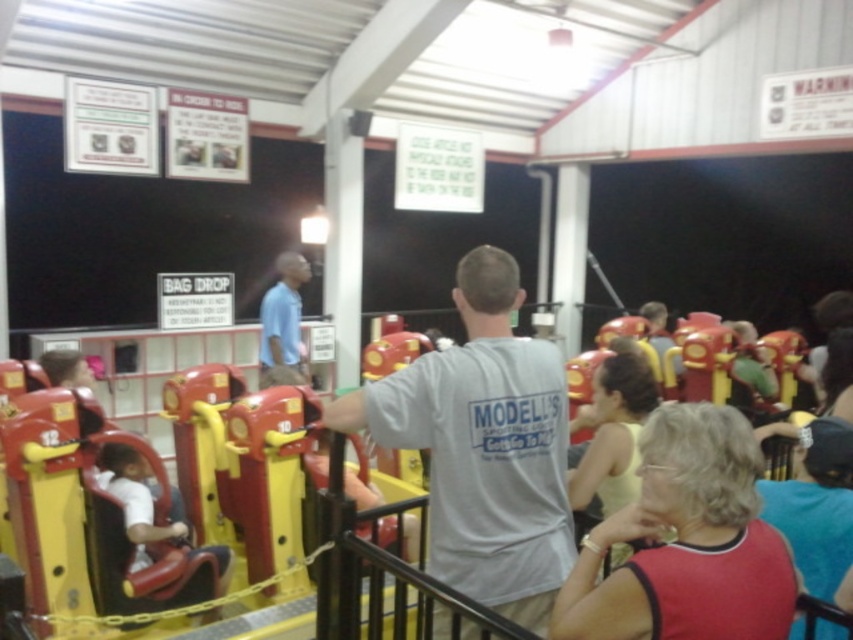
Question: Is gray cotton t-shirt at center to the left of red fabric shirt at lower right from the viewer's perspective?

Choices:
 (A) no
 (B) yes

Answer: (B)

Question: Considering the relative positions of gray cotton t-shirt at center and light blue shirt at center in the image provided, where is gray cotton t-shirt at center located with respect to light blue shirt at center?

Choices:
 (A) below
 (B) above

Answer: (A)

Question: Which of the following is the farthest from the observer?

Choices:
 (A) (627, 600)
 (B) (276, 353)
 (C) (395, 380)

Answer: (B)

Question: Does red fabric shirt at lower right have a smaller size compared to light blue shirt at center?

Choices:
 (A) yes
 (B) no

Answer: (A)

Question: Estimate the real-world distances between objects in this image. Which object is farther from the light blue shirt at center?

Choices:
 (A) red fabric shirt at lower right
 (B) gray cotton t-shirt at center

Answer: (A)

Question: Which point is closer to the camera?

Choices:
 (A) red fabric shirt at lower right
 (B) light blue shirt at center

Answer: (A)